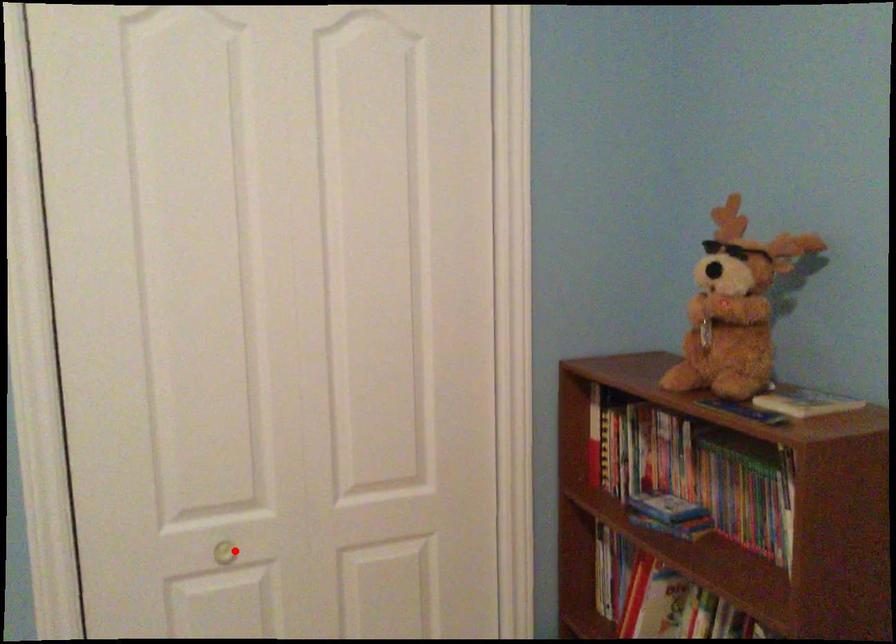
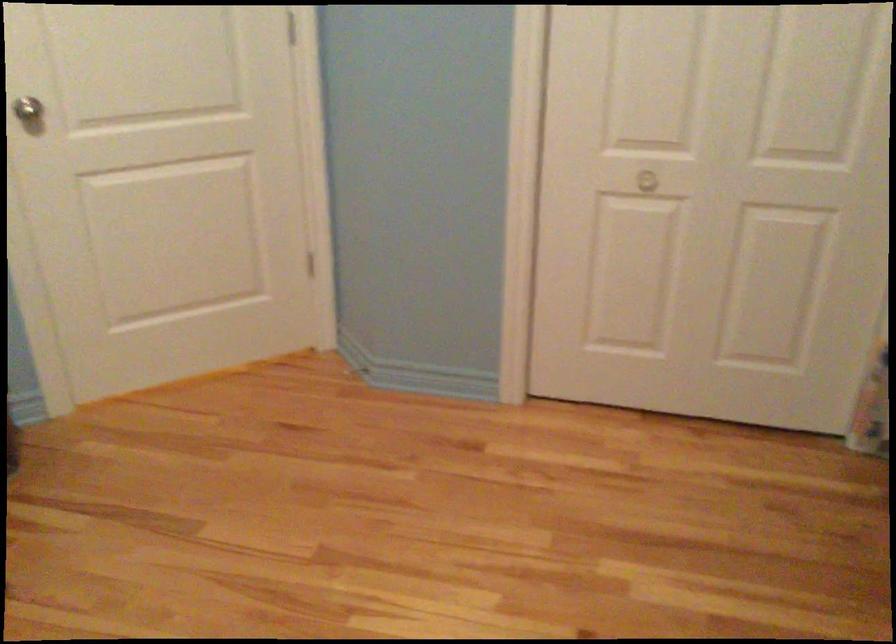
Question: I am providing you with two images of the same scene from different viewpoints. In image1, a red point is highlighted. Considering the same 3D point in image2, which of the following is correct?

Choices:
 (A) It is closer
 (B) It is farther

Answer: (B)